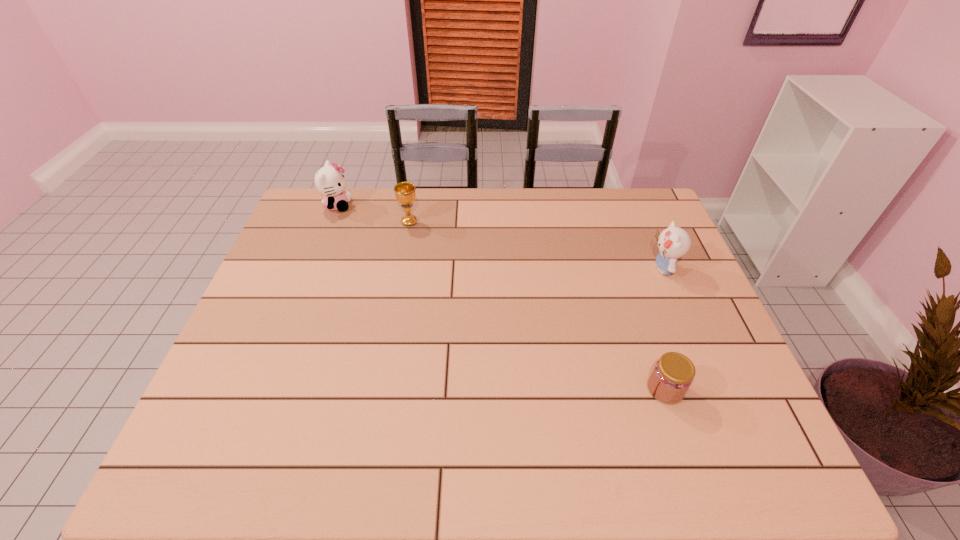
This screenshot has height=540, width=960. In order to click on free space located on the front-facing side of the nearer kitten in this screenshot , I will do `click(519, 268)`.

Locate an element on the screen. vacant space situated 0.080m on the back of the third object from right to left is located at coordinates (413, 202).

The image size is (960, 540). What are the coordinates of `free space located on the front of the shortest object` in the screenshot? It's located at (692, 469).

This screenshot has height=540, width=960. I want to click on kitten present at the far edge, so click(x=329, y=181).

Where is `chalice present at the far edge`? The image size is (960, 540). chalice present at the far edge is located at coordinates (405, 194).

This screenshot has height=540, width=960. I want to click on object that is at the left edge, so click(329, 181).

This screenshot has height=540, width=960. What are the coordinates of `kitten at the right edge` in the screenshot? It's located at (674, 242).

Find the location of a particular element. This screenshot has width=960, height=540. jam situated at the right edge is located at coordinates (673, 374).

I want to click on object positioned at the far left corner, so click(329, 181).

Find the location of a particular element. The width and height of the screenshot is (960, 540). vacant region at the far edge of the desktop is located at coordinates (566, 219).